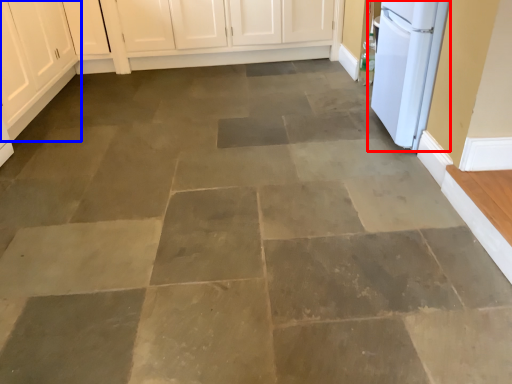
Question: Which point is further to the camera, home appliance (highlighted by a red box) or cabinetry (highlighted by a blue box)?

Choices:
 (A) home appliance
 (B) cabinetry

Answer: (B)